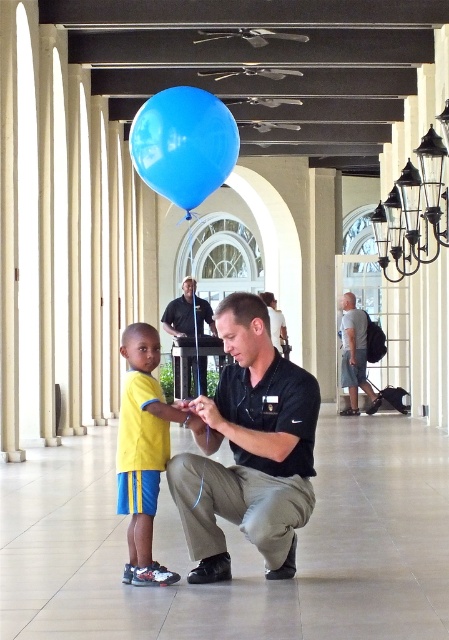
Question: Among these points, which one is farthest from the camera?

Choices:
 (A) (150, 472)
 (B) (192, 285)
 (C) (356, 336)
 (D) (210, 404)

Answer: (C)

Question: Does blue rubber balloon at center lie in front of black matte uniform at center?

Choices:
 (A) yes
 (B) no

Answer: (A)

Question: Can you confirm if matte black shirt at center is positioned below black matte uniform at center?

Choices:
 (A) yes
 (B) no

Answer: (B)

Question: Which point is closer to the camera taking this photo?

Choices:
 (A) (190, 358)
 (B) (287, 492)
 (C) (340, 333)
 (D) (115, 458)

Answer: (B)

Question: Is yellow fabric shirt at center to the right of gray fabric backpack at center-right from the viewer's perspective?

Choices:
 (A) no
 (B) yes

Answer: (A)

Question: Which point is farther to the camera?

Choices:
 (A) gray fabric backpack at center-right
 (B) matte black shirt at center
 (C) yellow fabric shirt at center
 (D) black matte uniform at center

Answer: (A)